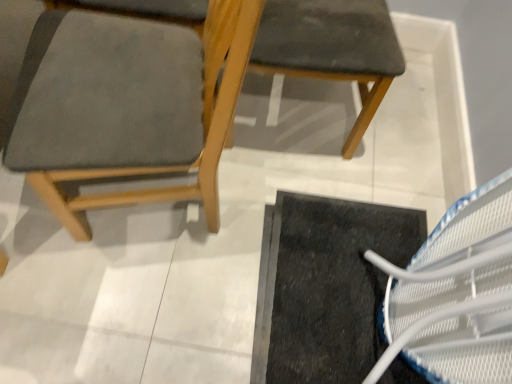
The height and width of the screenshot is (384, 512). I want to click on free location above black rubber doormat at lower right (from a real-world perspective), so click(x=331, y=276).